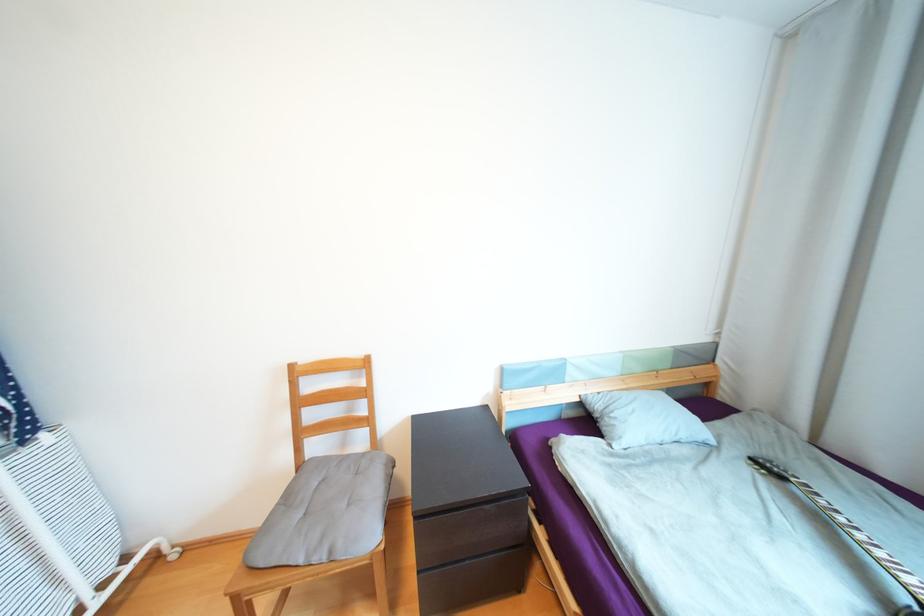
Where would you sit the chair sitting surface? Please return your answer as a coordinate pair (x, y).

(325, 512)